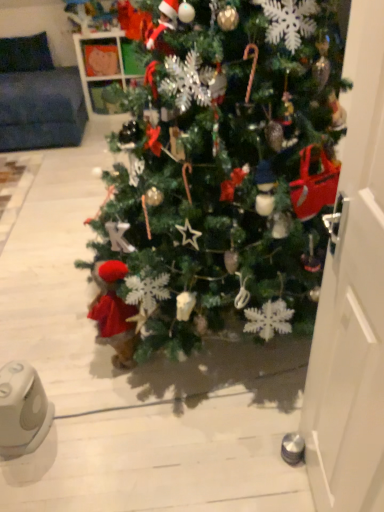
Question: Does white glossy door at right turn towards green matte christmas tree at center?

Choices:
 (A) yes
 (B) no

Answer: (B)

Question: Is white glossy door at right at the left side of green matte christmas tree at center?

Choices:
 (A) yes
 (B) no

Answer: (B)

Question: Is white glossy door at right not within green matte christmas tree at center?

Choices:
 (A) yes
 (B) no

Answer: (A)

Question: Is white glossy door at right turned away from green matte christmas tree at center?

Choices:
 (A) no
 (B) yes

Answer: (A)

Question: From the image's perspective, would you say white glossy door at right is shown under green matte christmas tree at center?

Choices:
 (A) no
 (B) yes

Answer: (B)

Question: Are white glossy door at right and green matte christmas tree at center far apart?

Choices:
 (A) no
 (B) yes

Answer: (A)

Question: Does white plastic ipod at lower left have a greater width compared to white glossy door at right?

Choices:
 (A) yes
 (B) no

Answer: (A)

Question: Is white plastic ipod at lower left bigger than white glossy door at right?

Choices:
 (A) yes
 (B) no

Answer: (B)

Question: From a real-world perspective, is white plastic ipod at lower left located beneath white glossy door at right?

Choices:
 (A) yes
 (B) no

Answer: (A)

Question: Can you confirm if white plastic ipod at lower left is smaller than white glossy door at right?

Choices:
 (A) yes
 (B) no

Answer: (A)

Question: From the image's perspective, is white plastic ipod at lower left located above white glossy door at right?

Choices:
 (A) no
 (B) yes

Answer: (A)

Question: Is white plastic ipod at lower left touching white glossy door at right?

Choices:
 (A) no
 (B) yes

Answer: (A)

Question: Is green matte christmas tree at center smaller than white plastic ipod at lower left?

Choices:
 (A) no
 (B) yes

Answer: (A)